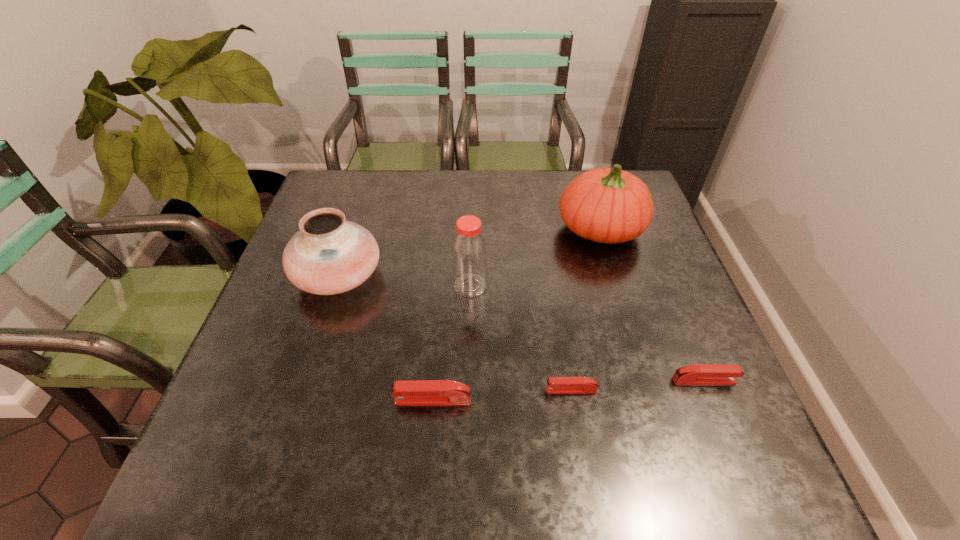
At what (x,y) coordinates should I click in order to perform the action: click on vacant space located 0.310m on the front-facing side of the nearest stapler. Please return your answer as a coordinate pair (x, y). This screenshot has height=540, width=960. Looking at the image, I should click on (237, 400).

Where is `vacant region located on the front-facing side of the nearest stapler`? The width and height of the screenshot is (960, 540). vacant region located on the front-facing side of the nearest stapler is located at coordinates (237, 400).

At what (x,y) coordinates should I click in order to perform the action: click on blank space located on the front-facing side of the shortest object. Please return your answer as a coordinate pair (x, y). Looking at the image, I should click on (466, 390).

Where is `vacant space situated on the front-facing side of the shortest object`? The image size is (960, 540). vacant space situated on the front-facing side of the shortest object is located at coordinates (386, 390).

You are a GUI agent. You are given a task and a screenshot of the screen. Output one action in this format:
    pyautogui.click(x=<x>, y=<y>)
    Task: Click on the vacant region located 0.100m on the front-facing side of the shortest object
    This screenshot has height=540, width=960.
    Given the screenshot: What is the action you would take?
    pyautogui.click(x=496, y=390)

Where is `vacant space located on the right of the bottle`? vacant space located on the right of the bottle is located at coordinates (630, 286).

Locate an element on the screen. vacant point located 0.300m on the front of the pumpkin is located at coordinates (638, 353).

Locate an element on the screen. vacant space located 0.290m on the right of the pottery is located at coordinates (498, 275).

Find the location of `object that is at the far edge`. object that is at the far edge is located at coordinates (606, 205).

This screenshot has width=960, height=540. I want to click on object situated at the left edge, so click(328, 255).